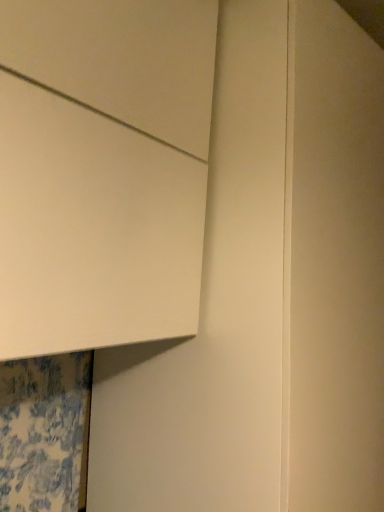
Question: Can you confirm if matte white door at upper left is wider than white matte cabinet at upper left?

Choices:
 (A) yes
 (B) no

Answer: (A)

Question: Considering the relative sizes of matte white door at upper left and white matte cabinet at upper left in the image provided, is matte white door at upper left taller than white matte cabinet at upper left?

Choices:
 (A) yes
 (B) no

Answer: (A)

Question: Is matte white door at upper left further to camera compared to white matte cabinet at upper left?

Choices:
 (A) yes
 (B) no

Answer: (A)

Question: Are matte white door at upper left and white matte cabinet at upper left making contact?

Choices:
 (A) yes
 (B) no

Answer: (B)

Question: Is white matte cabinet at upper left at the back of matte white door at upper left?

Choices:
 (A) no
 (B) yes

Answer: (A)

Question: From the image's perspective, is matte white door at upper left beneath white matte cabinet at upper left?

Choices:
 (A) yes
 (B) no

Answer: (A)

Question: Is white matte cabinet at upper left to the left of matte white door at upper left from the viewer's perspective?

Choices:
 (A) no
 (B) yes

Answer: (B)

Question: Considering the relative sizes of white matte cabinet at upper left and matte white door at upper left in the image provided, is white matte cabinet at upper left thinner than matte white door at upper left?

Choices:
 (A) yes
 (B) no

Answer: (A)

Question: Does white matte cabinet at upper left have a greater height compared to matte white door at upper left?

Choices:
 (A) yes
 (B) no

Answer: (B)

Question: Is white matte cabinet at upper left smaller than matte white door at upper left?

Choices:
 (A) yes
 (B) no

Answer: (A)

Question: Considering the relative positions of white matte cabinet at upper left and matte white door at upper left in the image provided, is white matte cabinet at upper left to the right of matte white door at upper left from the viewer's perspective?

Choices:
 (A) yes
 (B) no

Answer: (B)

Question: Is matte white door at upper left surrounded by white matte cabinet at upper left?

Choices:
 (A) no
 (B) yes

Answer: (A)

Question: Relative to matte white door at upper left, is white matte cabinet at upper left in front or behind?

Choices:
 (A) front
 (B) behind

Answer: (A)